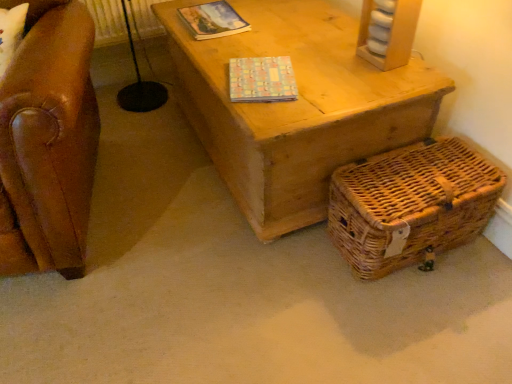
Question: From a real-world perspective, does multicolored paper book at upper center, the second magazine in the front-to-back sequence, stand above pastel mosaic-patterned book at center, which is the 1th magazine in bottom-to-top order?

Choices:
 (A) no
 (B) yes

Answer: (A)

Question: Is multicolored paper book at upper center, the second magazine in the front-to-back sequence, oriented away from pastel mosaic-patterned book at center, positioned as the first magazine in front-to-back order?

Choices:
 (A) yes
 (B) no

Answer: (B)

Question: Is there a large distance between multicolored paper book at upper center, which is the first magazine in top-to-bottom order, and pastel mosaic-patterned book at center, which is the 1th magazine in bottom-to-top order?

Choices:
 (A) yes
 (B) no

Answer: (B)

Question: Is multicolored paper book at upper center, which is the first magazine in top-to-bottom order, surrounding pastel mosaic-patterned book at center, marked as the second magazine in a top-to-bottom arrangement?

Choices:
 (A) yes
 (B) no

Answer: (B)

Question: Is multicolored paper book at upper center, which is the first magazine in top-to-bottom order, outside of pastel mosaic-patterned book at center, which ranks as the second magazine in back-to-front order?

Choices:
 (A) no
 (B) yes

Answer: (B)

Question: Is multicolored paper book at upper center, which is the first magazine in top-to-bottom order, thinner than pastel mosaic-patterned book at center, marked as the second magazine in a top-to-bottom arrangement?

Choices:
 (A) no
 (B) yes

Answer: (A)

Question: Is woven brown basket at lower right not inside multicolored paper book at upper center, which is the first magazine in top-to-bottom order?

Choices:
 (A) no
 (B) yes

Answer: (B)

Question: Is woven brown basket at lower right with multicolored paper book at upper center, the 1th magazine viewed from the back?

Choices:
 (A) yes
 (B) no

Answer: (B)

Question: From the image's perspective, is woven brown basket at lower right located beneath multicolored paper book at upper center, the 1th magazine viewed from the back?

Choices:
 (A) yes
 (B) no

Answer: (A)

Question: From the image's perspective, does woven brown basket at lower right appear higher than multicolored paper book at upper center, which is the second magazine in bottom-to-top order?

Choices:
 (A) yes
 (B) no

Answer: (B)

Question: Considering the relative sizes of woven brown basket at lower right and multicolored paper book at upper center, the second magazine in the front-to-back sequence, in the image provided, is woven brown basket at lower right bigger than multicolored paper book at upper center, the second magazine in the front-to-back sequence,?

Choices:
 (A) no
 (B) yes

Answer: (B)

Question: Is woven brown basket at lower right oriented away from multicolored paper book at upper center, which is the first magazine in top-to-bottom order?

Choices:
 (A) no
 (B) yes

Answer: (B)

Question: Could you tell me if multicolored paper book at upper center, which is the first magazine in top-to-bottom order, is facing woven brown basket at lower right?

Choices:
 (A) yes
 (B) no

Answer: (B)